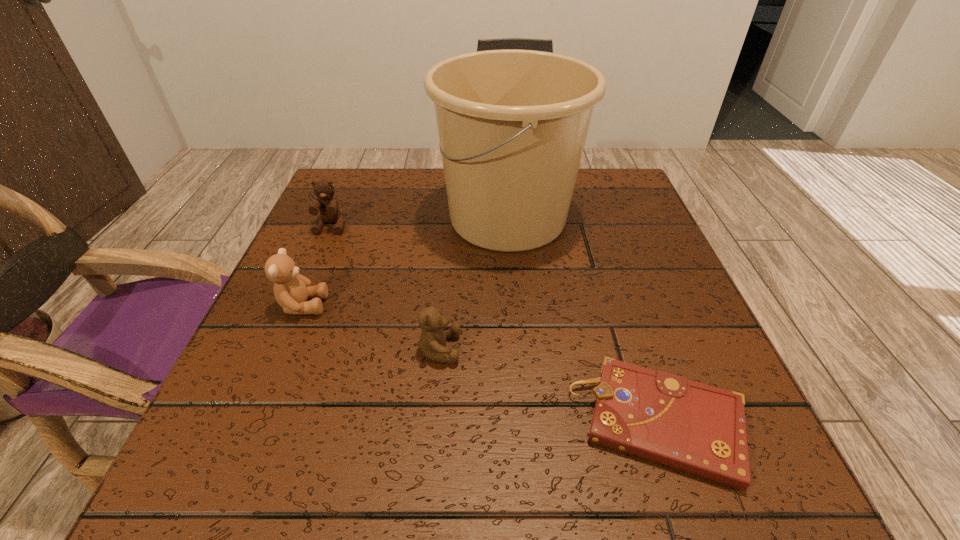
At what (x,y) coordinates should I click in order to perform the action: click on free point that satisfies the following two spatial constraints: 1. on the front-facing side of the shortest object; 2. on the right side of the nearest teddy bear. Please return your answer as a coordinate pair (x, y). Looking at the image, I should click on (432, 422).

You are a GUI agent. You are given a task and a screenshot of the screen. Output one action in this format:
    pyautogui.click(x=<x>, y=<y>)
    Task: Click on the vacant area that satisfies the following two spatial constraints: 1. on the back side of the notebook; 2. on the front-facing side of the nearest teddy bear
    This screenshot has width=960, height=540.
    Given the screenshot: What is the action you would take?
    pyautogui.click(x=636, y=349)

Where is `vacant space that satisfies the following two spatial constraints: 1. on the front-facing side of the shortest object; 2. on the right side of the nearest teddy bear`? This screenshot has height=540, width=960. vacant space that satisfies the following two spatial constraints: 1. on the front-facing side of the shortest object; 2. on the right side of the nearest teddy bear is located at coordinates (432, 422).

You are a GUI agent. You are given a task and a screenshot of the screen. Output one action in this format:
    pyautogui.click(x=<x>, y=<y>)
    Task: Click on the vacant area in the image that satisfies the following two spatial constraints: 1. on the face of the shortest object; 2. on the right side of the third nearest object
    
    Given the screenshot: What is the action you would take?
    pyautogui.click(x=254, y=422)